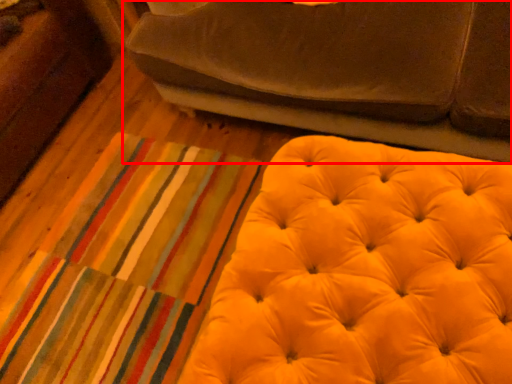
Question: Observing the image, what is the correct spatial positioning of studio couch (annotated by the red box) in reference to furniture?

Choices:
 (A) right
 (B) left

Answer: (A)